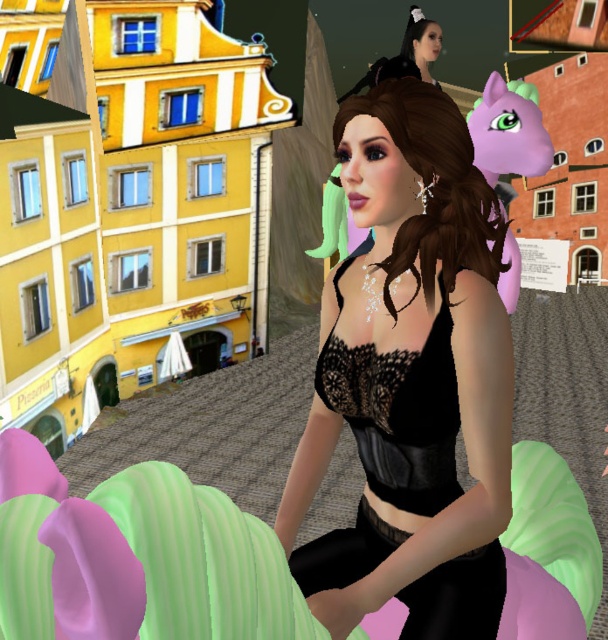
Based on the photo, you are a photographer setting up for a photoshoot in the pizzeria scene. You need to position a light source to the left of the black lace dress at center. Will the green rubber balloon at lower center interfere with the light placement?

The green rubber balloon at lower center is to the right of the black lace dress at center, so placing the light to the left of the black lace dress at center would not interfere with the green rubber balloon at lower center.

You are a photographer preparing to take a portrait of the central character wearing the black lace dress at center. You notice a green rubber balloon at lower center in the background. To ensure the dress is the main focus, should you adjust your camera angle to avoid the balloon? Explain why.

The green rubber balloon at lower center is located below the black lace dress at center, so adjusting the camera angle slightly upward would help keep the focus on the dress while avoiding the balloon in the lower area.

You are a photographer setting up for a photoshoot. You have a green rubber balloon at lower center and a black lace dress at center. Which object is wider?

The green rubber balloon at lower center is less wide than the black lace dress at center, so the black lace dress at center is wider.